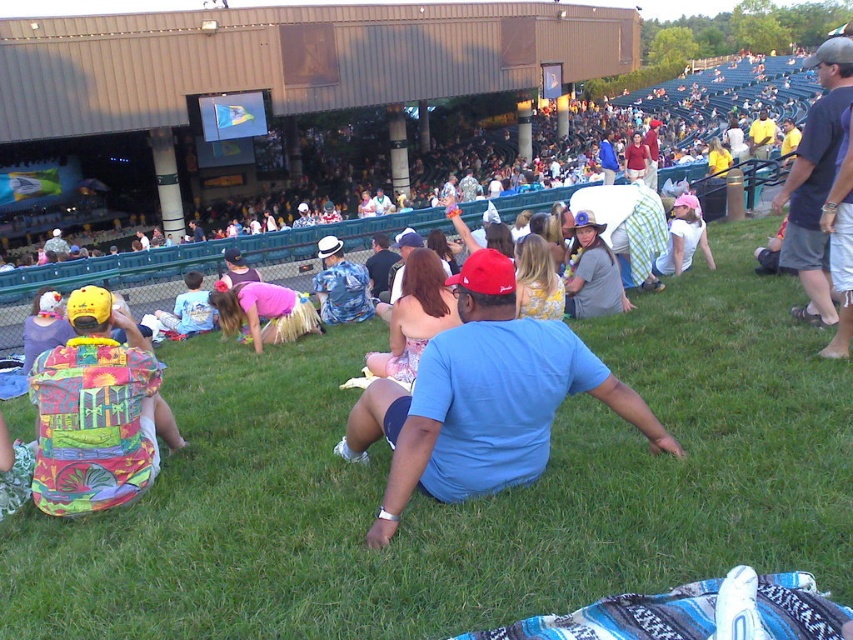
Who is more distant from viewer, (494, 468) or (90, 472)?

The point (90, 472) is more distant.

The width and height of the screenshot is (853, 640). Describe the element at coordinates (482, 400) in the screenshot. I see `blue cotton shirt at center` at that location.

Between point (509, 349) and point (65, 401), which one is positioned behind?

Positioned behind is point (65, 401).

The width and height of the screenshot is (853, 640). I want to click on blue cotton shirt at center, so click(482, 400).

Is green grass at center smaller than blue cotton shirt at center?

Indeed, green grass at center has a smaller size compared to blue cotton shirt at center.

Can you confirm if green grass at center is thinner than blue cotton shirt at center?

Correct, green grass at center's width is less than blue cotton shirt at center's.

Is point (173, 378) closer to viewer compared to point (575, 346)?

No, (173, 378) is further to viewer.

Where is `green grass at center`? This screenshot has height=640, width=853. green grass at center is located at coordinates (467, 500).

Does matte blue shirt at center have a lesser height compared to printed fabric backpack at lower left?

No.

The width and height of the screenshot is (853, 640). Identify the location of matte blue shirt at center. (688, 108).

At what (x,y) coordinates should I click in order to perform the action: click on matte blue shirt at center. Please return your answer as a coordinate pair (x, y). Looking at the image, I should click on (688, 108).